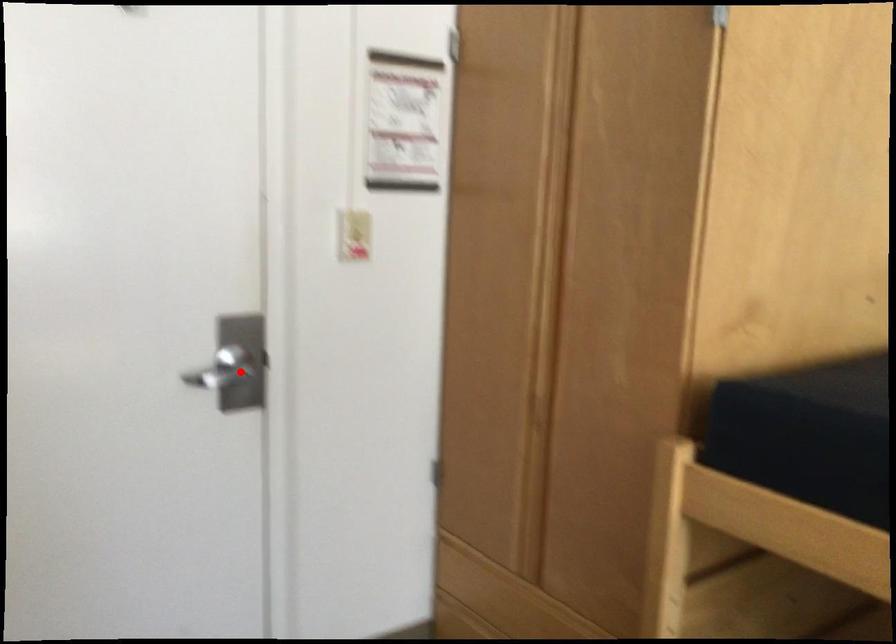
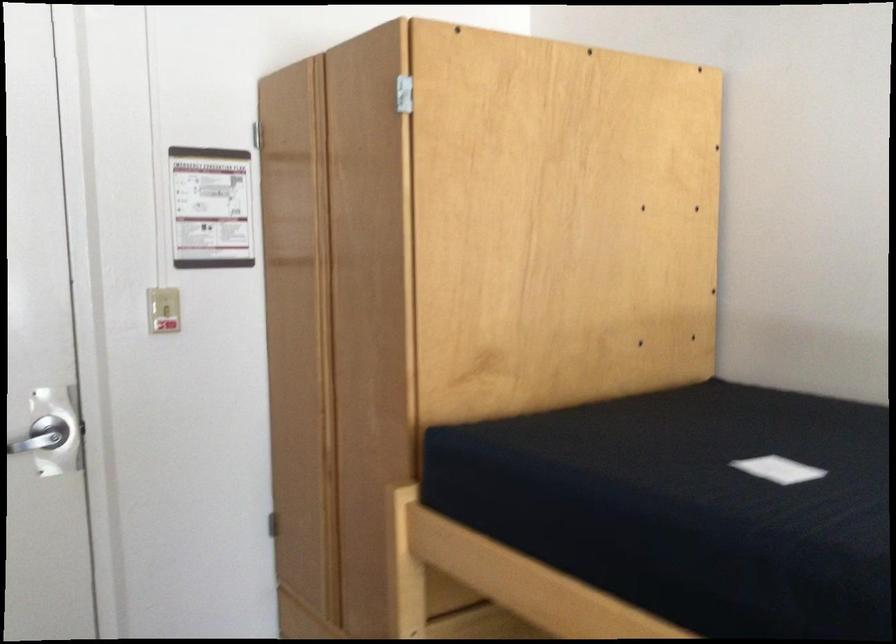
Locate, in the second image, the point that corresponds to the highlighted location in the first image.

(47, 440)